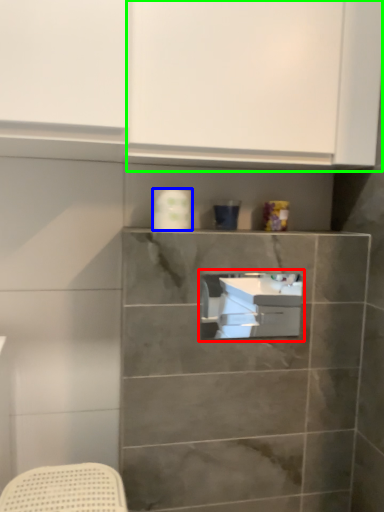
Question: Estimate the real-world distances between objects in this image. Which object is farther from sink (highlighted by a red box), toilet paper (highlighted by a blue box) or cabinetry (highlighted by a green box)?

Choices:
 (A) toilet paper
 (B) cabinetry

Answer: (B)